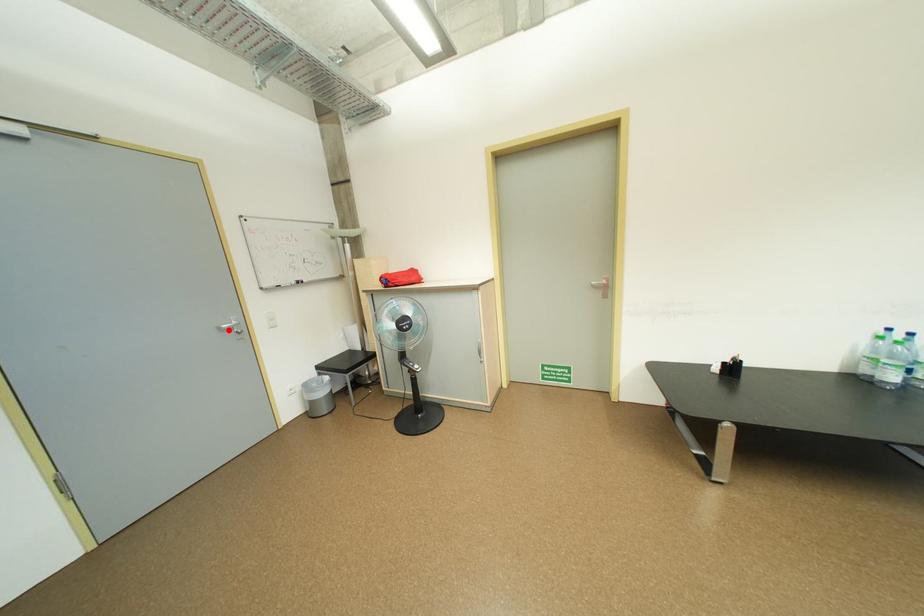
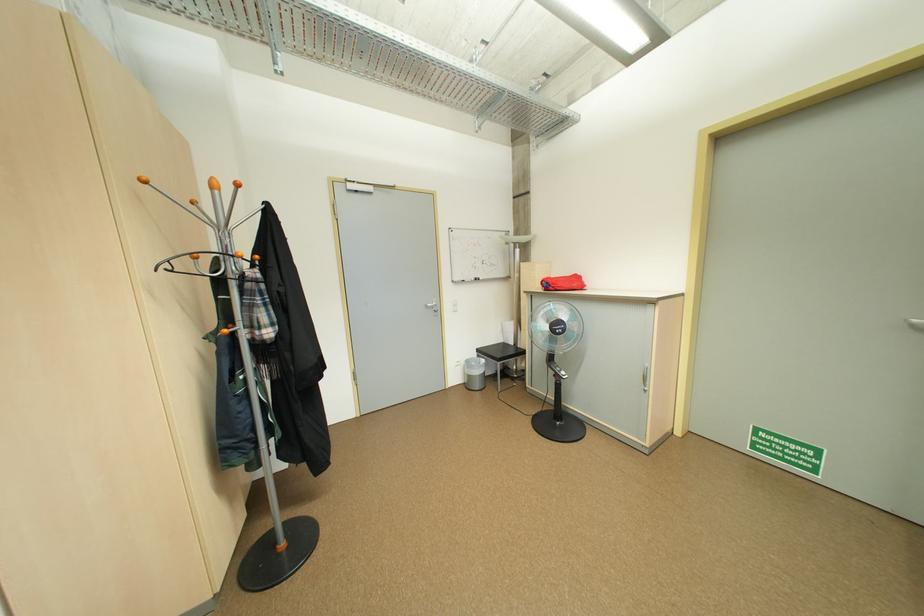
Find the pixel in the second image that matches the highlighted location in the first image.

(435, 307)